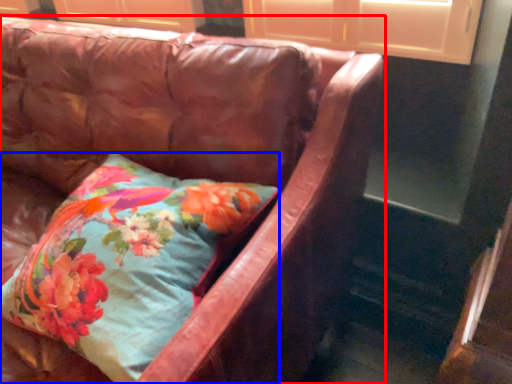
Question: Which object is closer to the camera taking this photo, studio couch (highlighted by a red box) or pillow (highlighted by a blue box)?

Choices:
 (A) studio couch
 (B) pillow

Answer: (A)